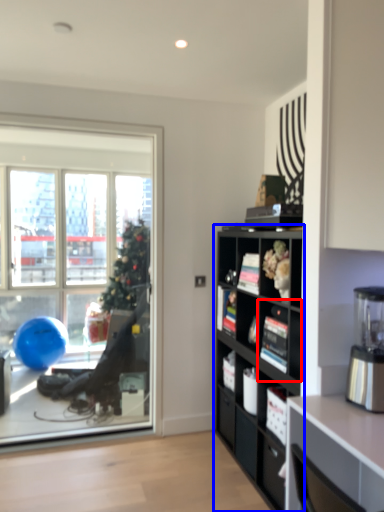
Question: Which of the following is the closest to the observer, shelf (highlighted by a red box) or cabinetry (highlighted by a blue box)?

Choices:
 (A) shelf
 (B) cabinetry

Answer: (B)